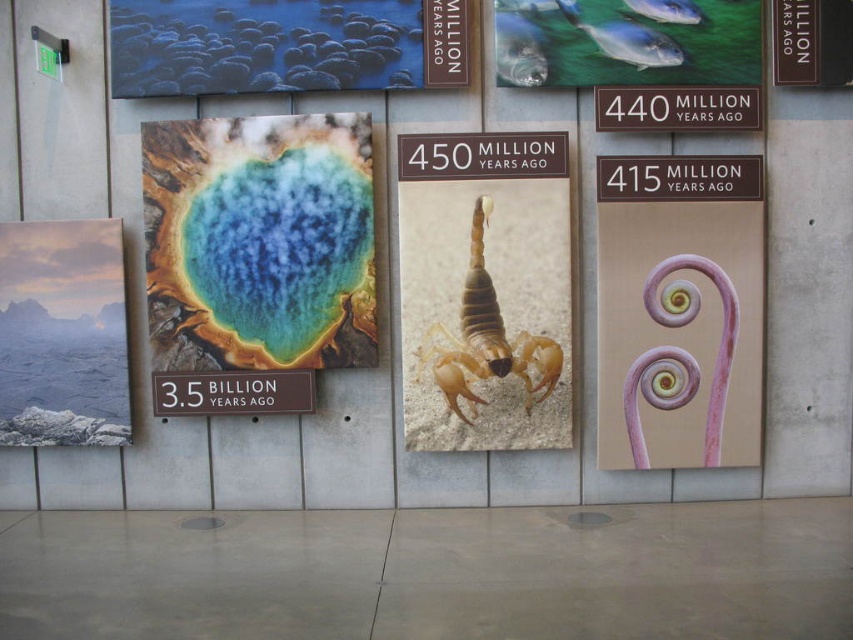
You are an archaeologist examining the educational panels. You notice the rustic stone landscape at left and the translucent beige scorpion at center. Which object is located to the left of the other?

The rustic stone landscape at left is positioned on the left side of the translucent beige scorpion at center.

You are a student standing in front of the leftmost panel of the educational panels. You see a translucent beige scorpion at center and a black plastic sign at upper center. Which object is taller?

The translucent beige scorpion at center is much taller than the black plastic sign at upper center.

From the picture: You are an archaeologist examining the educational panels. You notice the rustic stone landscape at left and the translucent beige scorpion at center. Which object is closer to you?

The rustic stone landscape at left is closer to you because it is further to the viewer than the translucent beige scorpion at center.